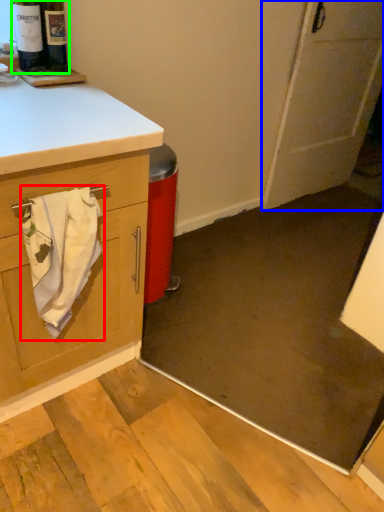
Question: Estimate the real-world distances between objects in this image. Which object is closer to bath towel (highlighted by a red box), door (highlighted by a blue box) or beer bottle (highlighted by a green box)?

Choices:
 (A) door
 (B) beer bottle

Answer: (B)